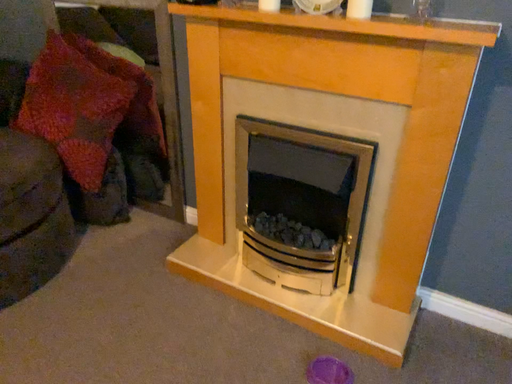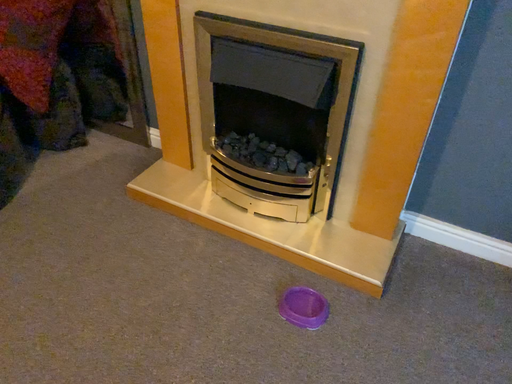
Question: Which way did the camera rotate in the video?

Choices:
 (A) rotated upward
 (B) rotated downward

Answer: (B)